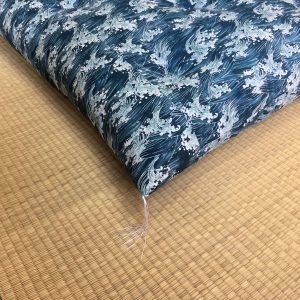
This screenshot has width=300, height=300. Find the location of `pillow`. pillow is located at coordinates coord(178,68).